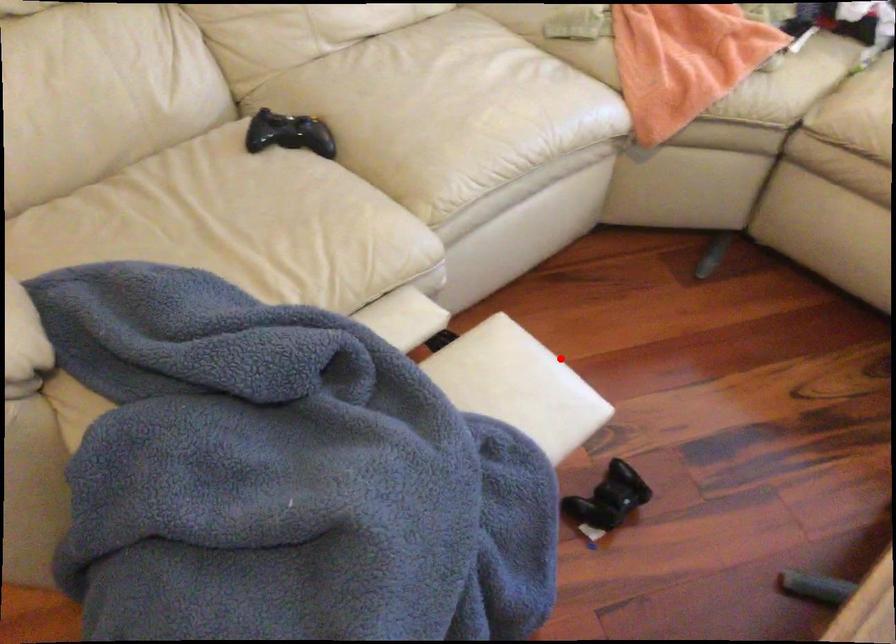
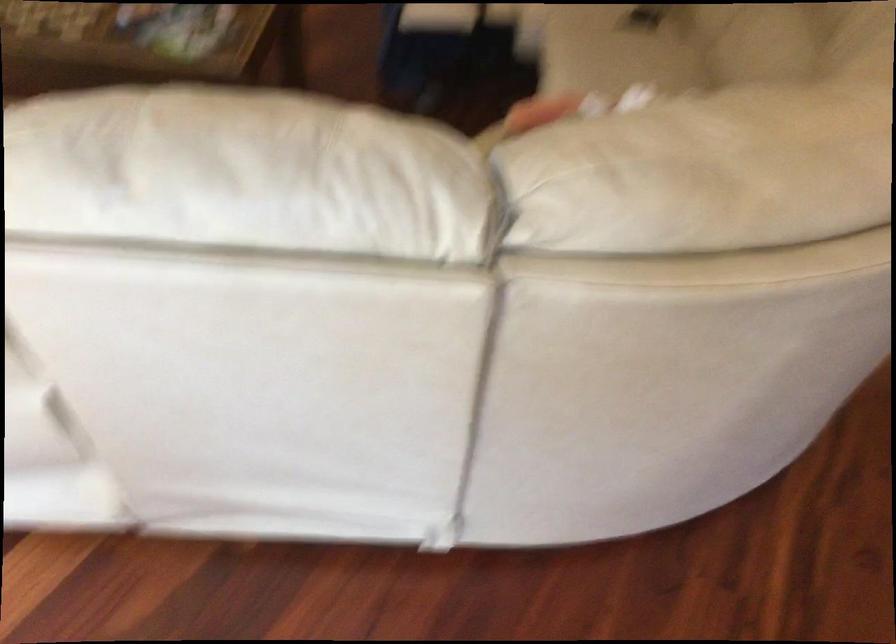
Find the pixel in the second image that matches the highlighted location in the first image.

(437, 17)